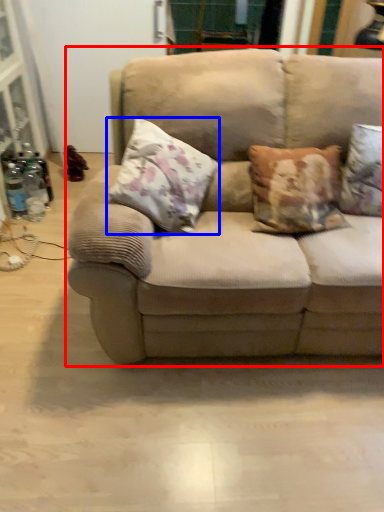
Question: Which point is further to the camera, studio couch (highlighted by a red box) or pillow (highlighted by a blue box)?

Choices:
 (A) studio couch
 (B) pillow

Answer: (B)